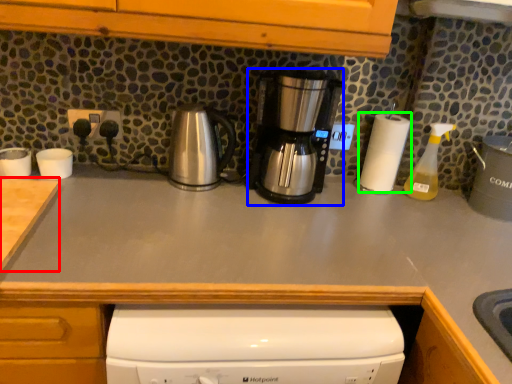
Question: Which object is the farthest from counter top (highlighted by a red box)? Choose among these: kitchen appliance (highlighted by a blue box) or paper towel (highlighted by a green box).

Choices:
 (A) kitchen appliance
 (B) paper towel

Answer: (B)